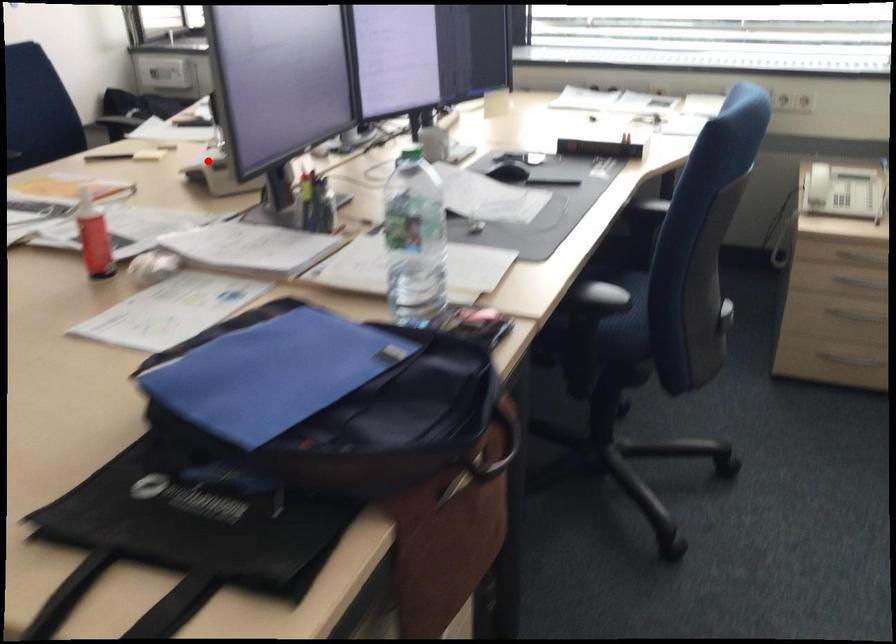
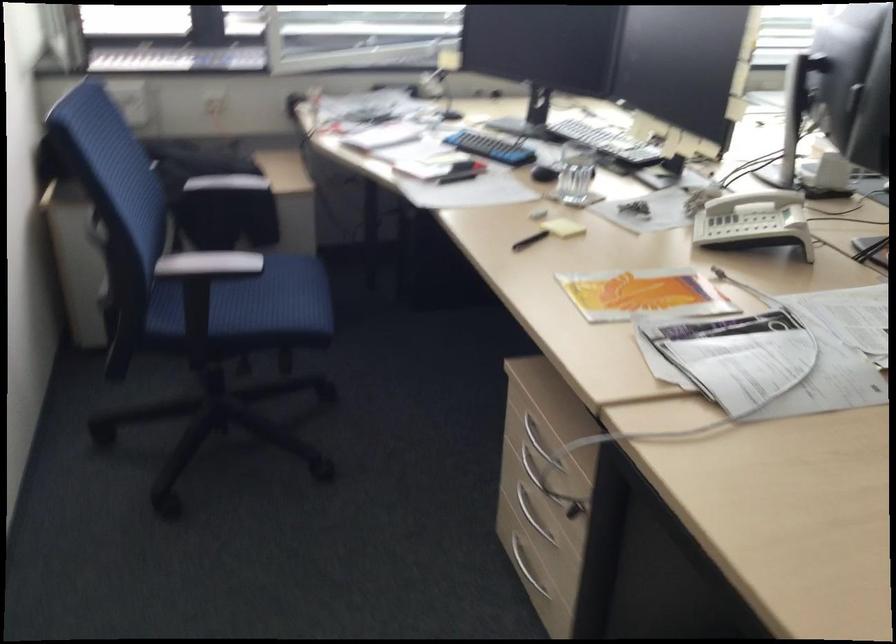
Question: I am providing you with two images of the same scene from different viewpoints. Given a red point in image1, look at the same physical point in image2. Is it:

Choices:
 (A) Closer to the viewpoint
 (B) Farther from the viewpoint

Answer: (A)